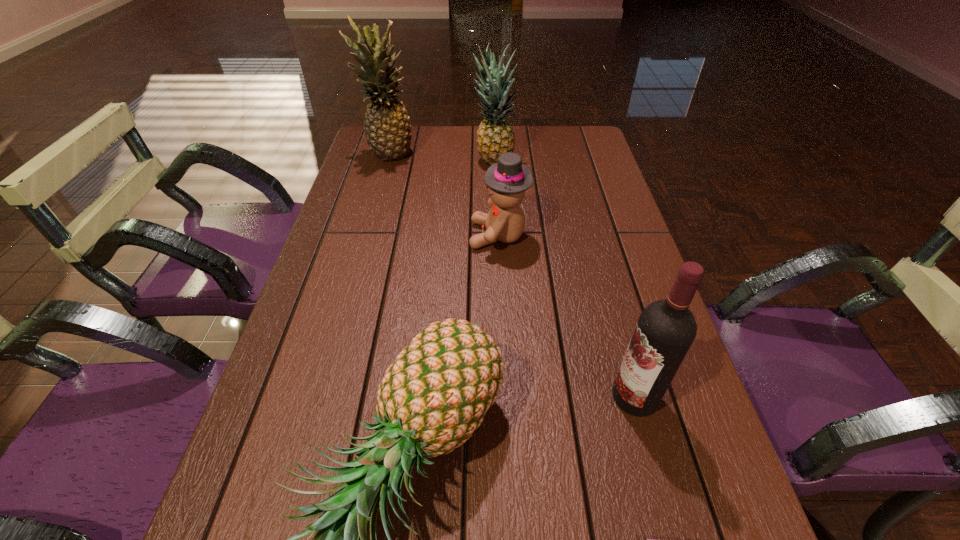
Where is `pineapple that stands as the closest to the wine bottle`? The height and width of the screenshot is (540, 960). pineapple that stands as the closest to the wine bottle is located at coordinates (433, 397).

Select which pineapple appears as the second closest to the fourth nearest object. Please provide its 2D coordinates. Your answer should be formatted as a tuple, i.e. [(x, y)], where the tuple contains the x and y coordinates of a point satisfying the conditions above.

[(433, 397)]